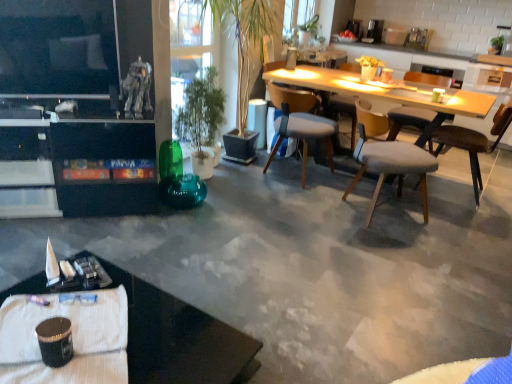
I want to click on free space to the back side of metallic pen at lower left, so click(48, 287).